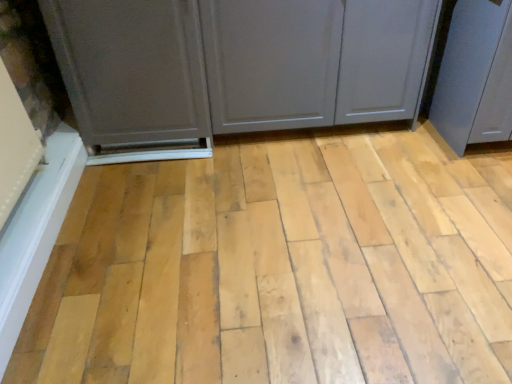
Question: Is matte gray cupboard at center closer to the viewer compared to matte gray screen door at right, the first screen door in the right-to-left sequence?

Choices:
 (A) no
 (B) yes

Answer: (A)

Question: Is matte gray cupboard at center thinner than matte gray screen door at right, the first screen door in the right-to-left sequence?

Choices:
 (A) yes
 (B) no

Answer: (A)

Question: From a real-world perspective, is matte gray cupboard at center physically above matte gray screen door at right, which appears as the 2th screen door when viewed from the left?

Choices:
 (A) no
 (B) yes

Answer: (A)

Question: Is matte gray screen door at right, which appears as the 2th screen door when viewed from the left, at the back of matte gray cupboard at center?

Choices:
 (A) no
 (B) yes

Answer: (A)

Question: Considering the relative sizes of matte gray cupboard at center and matte gray screen door at right, which appears as the 2th screen door when viewed from the left, in the image provided, is matte gray cupboard at center taller than matte gray screen door at right, which appears as the 2th screen door when viewed from the left,?

Choices:
 (A) no
 (B) yes

Answer: (A)

Question: In the image, is natural wood plank at center positioned in front of or behind matte gray cupboard at center?

Choices:
 (A) behind
 (B) front

Answer: (B)

Question: Does point (360, 297) appear closer or farther from the camera than point (285, 21)?

Choices:
 (A) closer
 (B) farther

Answer: (A)

Question: Considering the relative positions of natural wood plank at center and matte gray cupboard at center in the image provided, is natural wood plank at center to the left or to the right of matte gray cupboard at center?

Choices:
 (A) right
 (B) left

Answer: (B)

Question: From their relative heights in the image, would you say natural wood plank at center is taller or shorter than matte gray cupboard at center?

Choices:
 (A) short
 (B) tall

Answer: (A)

Question: From a real-world perspective, is matte gray cupboard at center above or below natural wood plank at center?

Choices:
 (A) below
 (B) above

Answer: (B)

Question: Is matte gray cupboard at center taller or shorter than natural wood plank at center?

Choices:
 (A) short
 (B) tall

Answer: (B)

Question: Which is correct: matte gray cupboard at center is inside natural wood plank at center, or outside of it?

Choices:
 (A) inside
 (B) outside

Answer: (B)

Question: From the image's perspective, relative to natural wood plank at center, is matte gray cupboard at center above or below?

Choices:
 (A) above
 (B) below

Answer: (A)

Question: Is matte gray screen door at right, the first screen door in the right-to-left sequence, situated inside natural wood plank at center or outside?

Choices:
 (A) outside
 (B) inside

Answer: (A)

Question: In terms of height, does matte gray screen door at right, which appears as the 2th screen door when viewed from the left, look taller or shorter compared to natural wood plank at center?

Choices:
 (A) short
 (B) tall

Answer: (B)